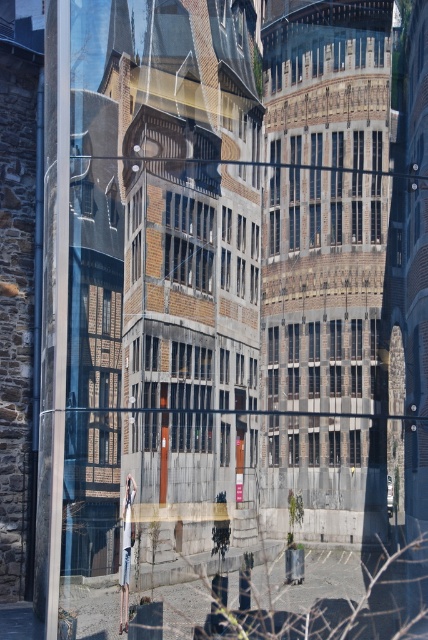
You are standing in front of the historic building and want to take a photo of the dark gray stone window at center. If your camera can focus on objects up to 7 meters away, will you be able to capture the window clearly?

The dark gray stone window at center is 6.72 meters away from you. Since your camera can focus up to 7 meters, you can capture the window clearly as it is within the camera range.

You are an architect analyzing the facade of the historic building. You notice two windows at the center of the building. Which one is positioned lower in the structure, the dark gray stone window at center or the brown brick window at center?

The dark gray stone window at center is positioned lower than the brown brick window at center, as it is situated below it in the building facade.